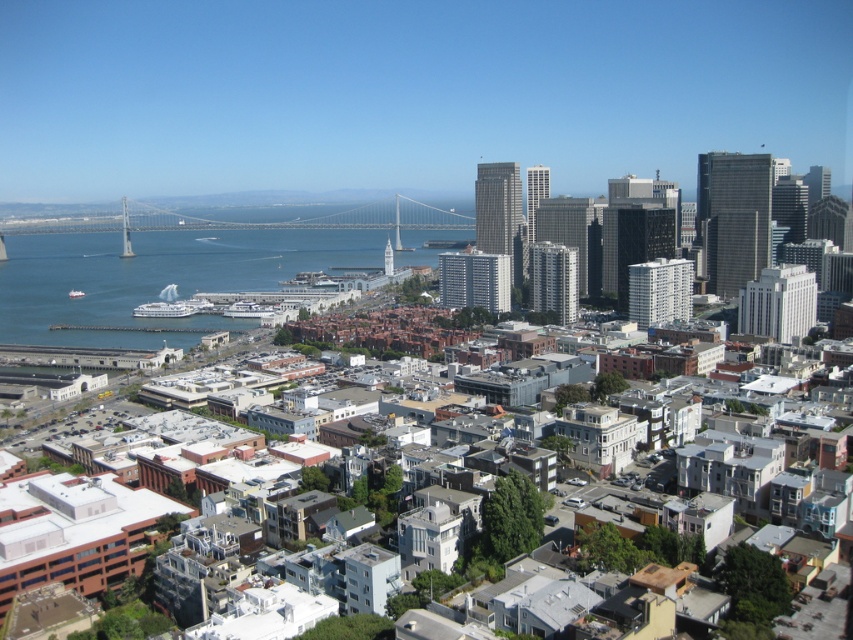
Can you confirm if blue water at lower left is positioned below white glossy cruise ship at center?

No.

Can you confirm if blue water at lower left is thinner than white glossy cruise ship at center?

In fact, blue water at lower left might be wider than white glossy cruise ship at center.

This screenshot has height=640, width=853. Find the location of `blue water at lower left`. blue water at lower left is located at coordinates (155, 276).

I want to click on white glossy cruise ship at lower left, so click(x=164, y=308).

Measure the distance between white glossy cruise ship at lower left and white glossy cruise ship at center.

white glossy cruise ship at lower left is 34.15 meters away from white glossy cruise ship at center.

Which is in front, point (193, 308) or point (271, 307)?

Point (271, 307) is in front.

Identify the location of white glossy cruise ship at lower left. Image resolution: width=853 pixels, height=640 pixels. (164, 308).

Is point (10, 221) more distant than point (265, 308)?

Yes.

Consider the image. Which of these two, metallic gray bridge at center or white glossy cruise ship at center, stands shorter?

With less height is white glossy cruise ship at center.

Which is in front, point (3, 250) or point (252, 310)?

Point (252, 310) is in front.

This screenshot has height=640, width=853. I want to click on metallic gray bridge at center, so click(x=244, y=221).